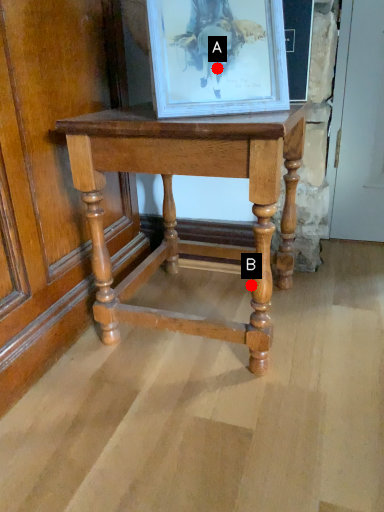
Question: Two points are circled on the image, labeled by A and B beside each circle. Which point appears closest to the camera in this image?

Choices:
 (A) A is closer
 (B) B is closer

Answer: (A)